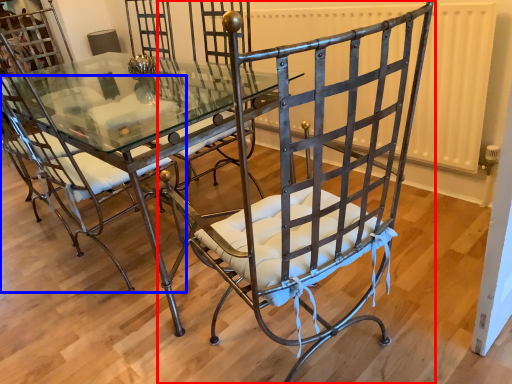
Question: Which of the following is the closest to the observer, chair (highlighted by a red box) or chair (highlighted by a blue box)?

Choices:
 (A) chair
 (B) chair

Answer: (A)